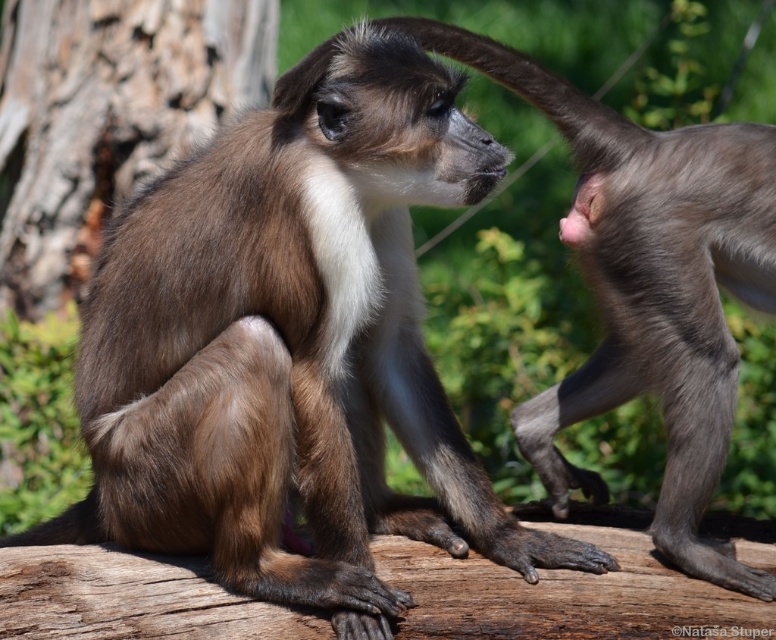
Question: Which point is closer to the camera taking this photo?

Choices:
 (A) (764, 296)
 (B) (47, 20)

Answer: (A)

Question: Is brown fur monkey at upper right below brown rough bark at left?

Choices:
 (A) no
 (B) yes

Answer: (B)

Question: From the image, what is the correct spatial relationship of brown fur monkey at upper right in relation to brown rough bark at left?

Choices:
 (A) below
 (B) above

Answer: (A)

Question: Does brown fur monkey at upper right have a larger size compared to brown rough bark at left?

Choices:
 (A) no
 (B) yes

Answer: (B)

Question: Among these objects, which one is nearest to the camera?

Choices:
 (A) brown fur monkey at upper right
 (B) brown rough bark at left

Answer: (A)